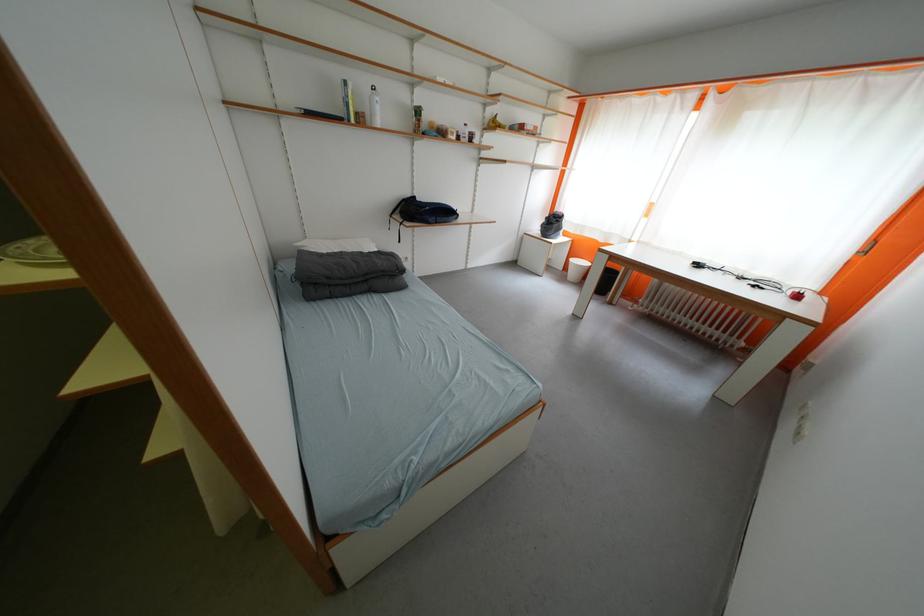
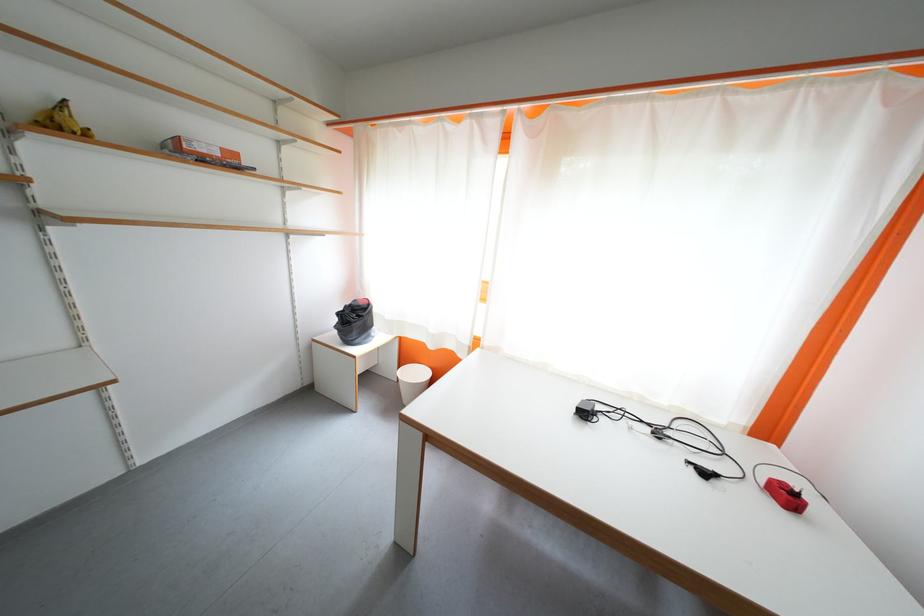
Locate, in the second image, the point that corresponds to the point at 763,290 in the first image.

(713, 477)